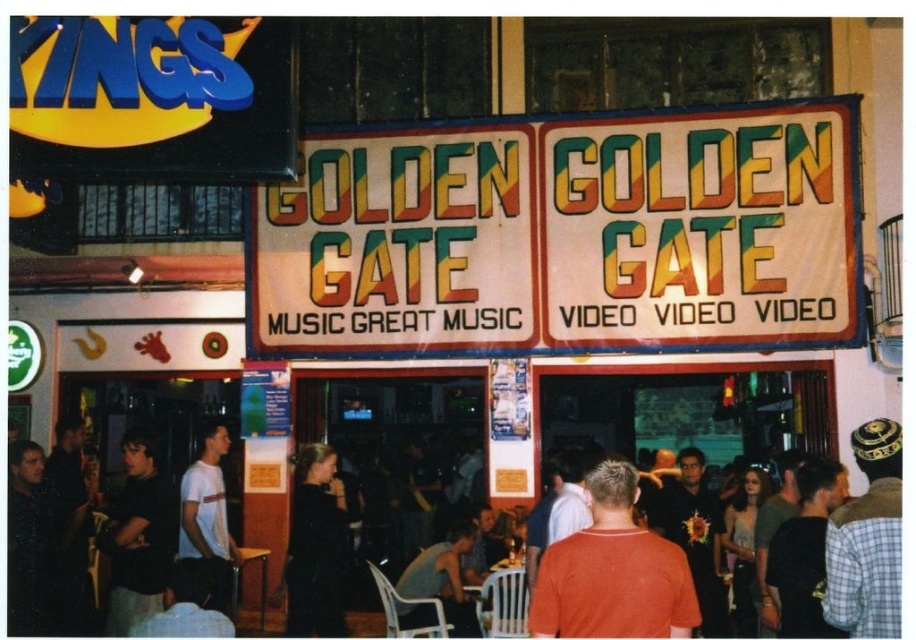
Question: Which point is farther to the camera?

Choices:
 (A) (544, 602)
 (B) (857, 109)
 (C) (900, 477)

Answer: (B)

Question: Can you confirm if black matte dress at center is positioned to the right of white matte t-shirt at center?

Choices:
 (A) yes
 (B) no

Answer: (A)

Question: Which object is positioned farthest from the black matte dress at center?

Choices:
 (A) plaid fabric shirt at right
 (B) white matte t-shirt at center
 (C) orange t-shirt at center
 (D) white fabric sign at center

Answer: (A)

Question: Which object is closer to the camera taking this photo?

Choices:
 (A) orange t-shirt at center
 (B) plaid fabric shirt at right
 (C) dark gray shirt at left
 (D) black matte dress at center

Answer: (A)

Question: Considering the relative positions of dark gray shirt at left and white matte t-shirt at center in the image provided, where is dark gray shirt at left located with respect to white matte t-shirt at center?

Choices:
 (A) left
 (B) right

Answer: (A)

Question: Does white fabric sign at center appear on the right side of white matte t-shirt at center?

Choices:
 (A) yes
 (B) no

Answer: (A)